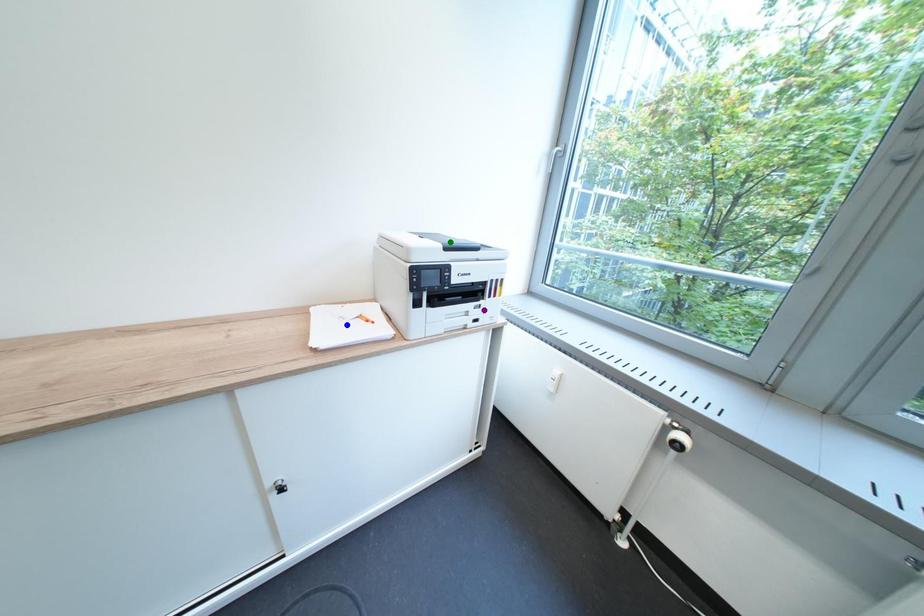
Order these from farthest to nearest:
1. green point
2. blue point
3. purple point

purple point, blue point, green point